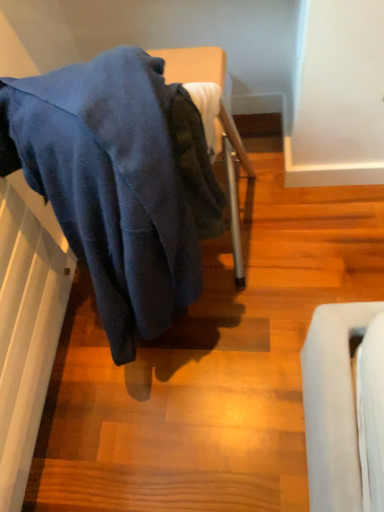
In order to face dark blue fabric at center, should I rotate leftwards or rightwards?

You should rotate left by 8.196 degrees.

Where is `dark blue fabric at center`? The width and height of the screenshot is (384, 512). dark blue fabric at center is located at coordinates (119, 182).

Image resolution: width=384 pixels, height=512 pixels. What do you see at coordinates (119, 182) in the screenshot?
I see `dark blue fabric at center` at bounding box center [119, 182].

What are the coordinates of `dark blue fabric at center` in the screenshot? It's located at (119, 182).